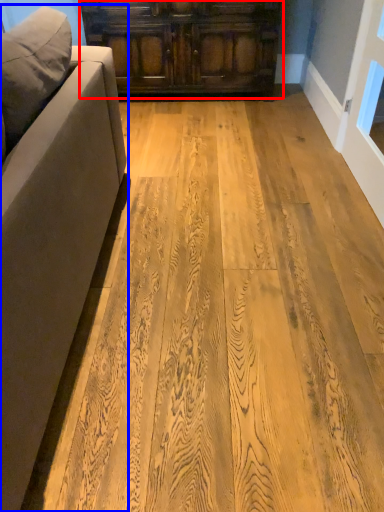
Question: Which of the following is the closest to the observer, cabinetry (highlighted by a red box) or studio couch (highlighted by a blue box)?

Choices:
 (A) cabinetry
 (B) studio couch

Answer: (B)